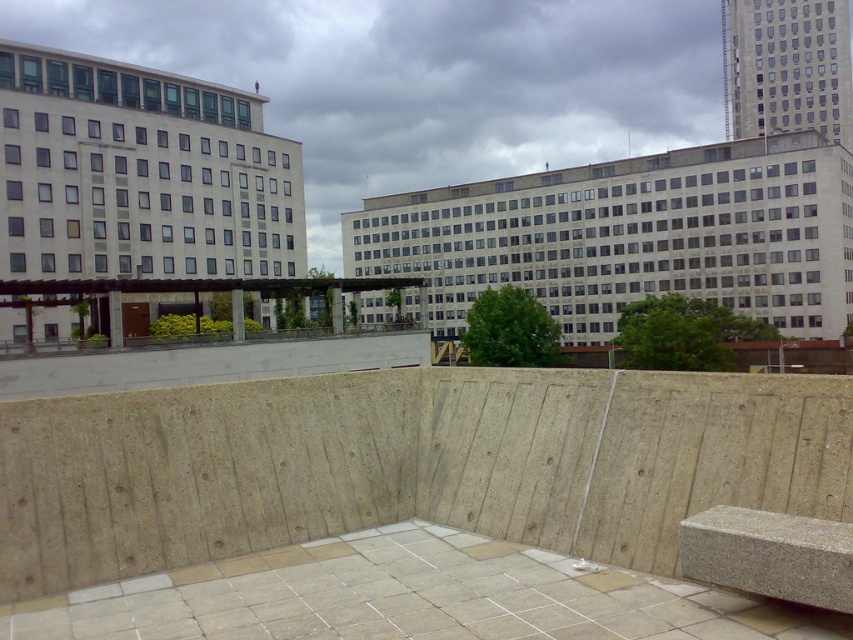
Does concrete ledge at center appear under granite bench at lower right?

Correct, concrete ledge at center is located below granite bench at lower right.

Does concrete ledge at center appear on the left side of granite bench at lower right?

Indeed, concrete ledge at center is positioned on the left side of granite bench at lower right.

The image size is (853, 640). What do you see at coordinates (207, 364) in the screenshot? I see `concrete ledge at center` at bounding box center [207, 364].

Image resolution: width=853 pixels, height=640 pixels. Find the location of `concrete ledge at center`. concrete ledge at center is located at coordinates (207, 364).

The width and height of the screenshot is (853, 640). What do you see at coordinates (410, 596) in the screenshot?
I see `gray concrete bench at lower right` at bounding box center [410, 596].

Can you confirm if gray concrete bench at lower right is positioned above concrete ledge at center?

Correct, gray concrete bench at lower right is located above concrete ledge at center.

The height and width of the screenshot is (640, 853). In order to click on gray concrete bench at lower right in this screenshot , I will do `click(410, 596)`.

This screenshot has height=640, width=853. I want to click on gray concrete bench at lower right, so (x=410, y=596).

Does point (316, 609) come closer to viewer compared to point (846, 522)?

No, it is not.

Between gray concrete bench at lower right and granite bench at lower right, which one appears on the right side from the viewer's perspective?

granite bench at lower right

Describe the element at coordinates (410, 596) in the screenshot. I see `gray concrete bench at lower right` at that location.

Find the location of a particular element. This screenshot has height=640, width=853. gray concrete bench at lower right is located at coordinates (410, 596).